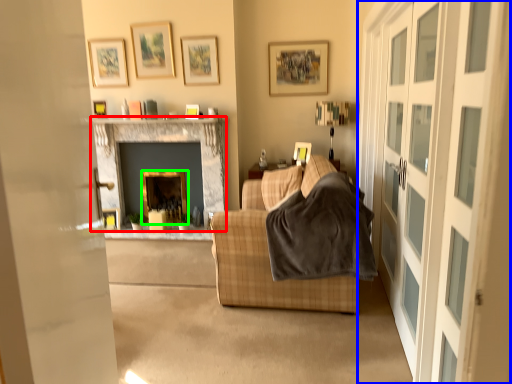
Question: Based on their relative distances, which object is farther from fireplace (highlighted by a red box)? Choose from glass door (highlighted by a blue box) and fireplace (highlighted by a green box).

Choices:
 (A) glass door
 (B) fireplace

Answer: (A)